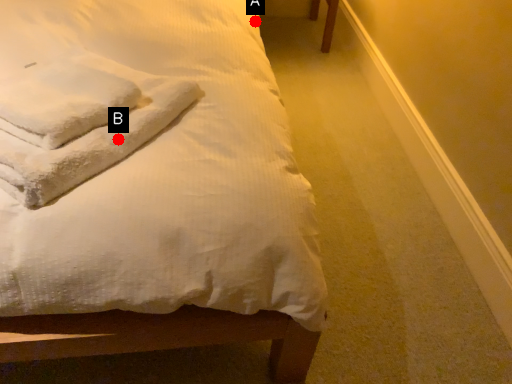
Question: Two points are circled on the image, labeled by A and B beside each circle. Which point is closer to the camera taking this photo?

Choices:
 (A) A is closer
 (B) B is closer

Answer: (B)